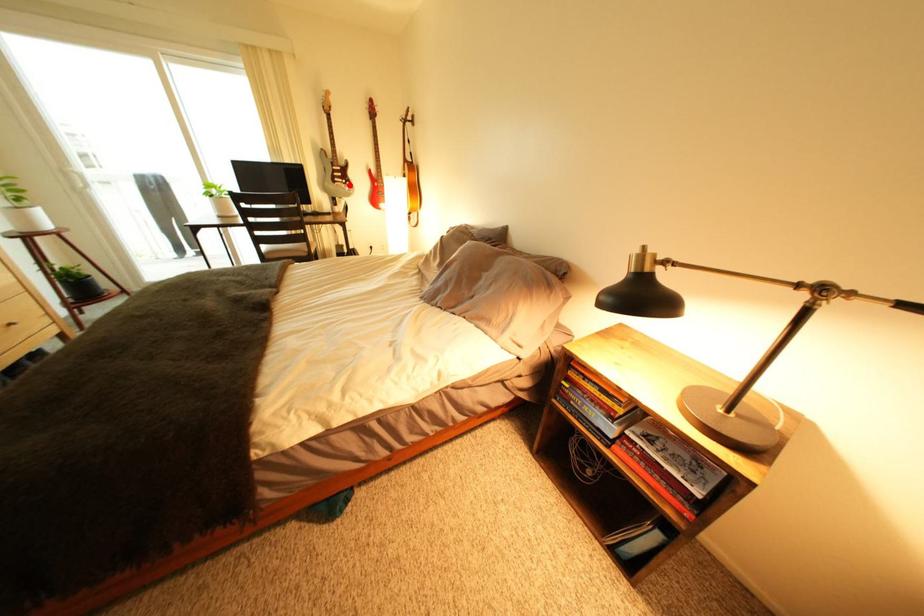
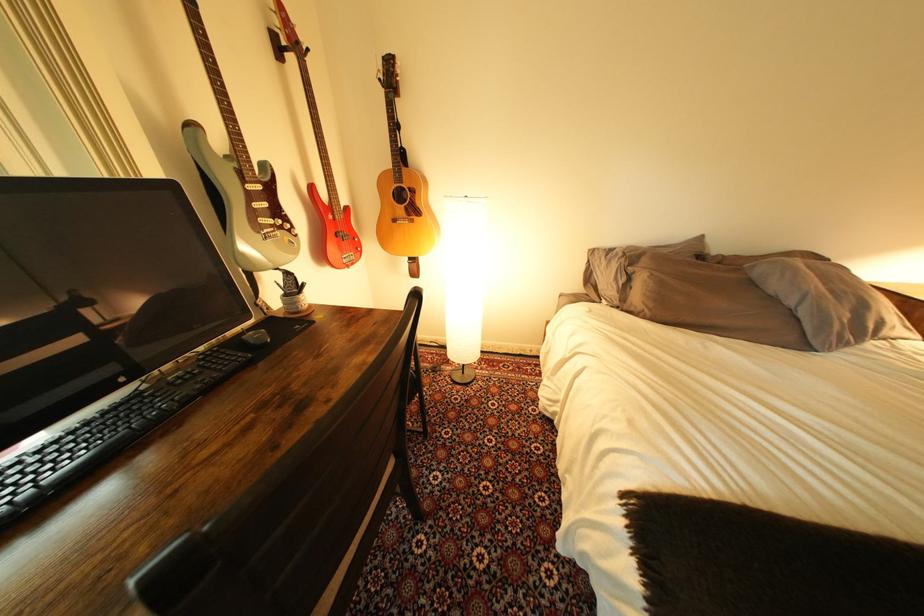
The point at the highlighted location is marked in the first image. Where is the corresponding point in the second image?

(278, 233)